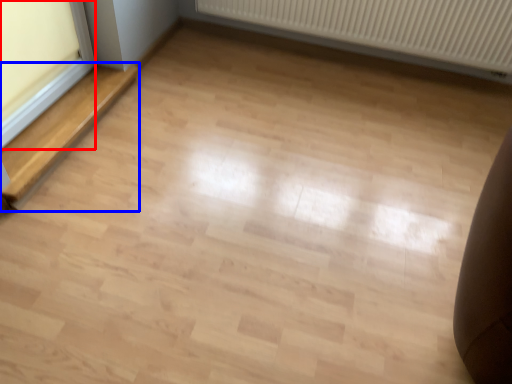
Question: Which point is further to the camera, window frame (highlighted by a red box) or stairwell (highlighted by a blue box)?

Choices:
 (A) window frame
 (B) stairwell

Answer: (B)